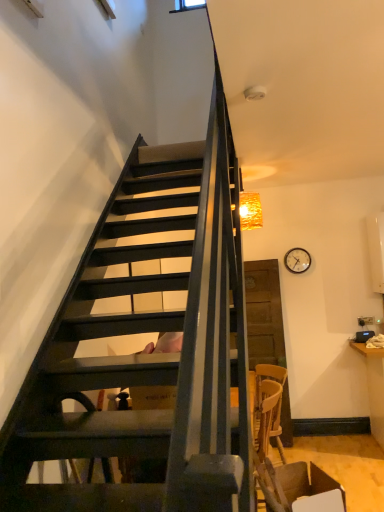
Question: From a real-world perspective, does brown leather armchair at lower right stand above wooden clock at upper right?

Choices:
 (A) no
 (B) yes

Answer: (A)

Question: Can you confirm if brown leather armchair at lower right is smaller than wooden clock at upper right?

Choices:
 (A) no
 (B) yes

Answer: (A)

Question: Is brown leather armchair at lower right shorter than wooden clock at upper right?

Choices:
 (A) yes
 (B) no

Answer: (B)

Question: Can you confirm if brown leather armchair at lower right is taller than wooden clock at upper right?

Choices:
 (A) yes
 (B) no

Answer: (A)

Question: Is brown leather armchair at lower right to the left of wooden clock at upper right from the viewer's perspective?

Choices:
 (A) yes
 (B) no

Answer: (A)

Question: Can you confirm if brown leather armchair at lower right is thinner than wooden clock at upper right?

Choices:
 (A) yes
 (B) no

Answer: (B)

Question: Is crinkled gold lampshade at upper right aimed at wooden clock at upper right?

Choices:
 (A) yes
 (B) no

Answer: (B)

Question: Does crinkled gold lampshade at upper right come behind wooden clock at upper right?

Choices:
 (A) no
 (B) yes

Answer: (A)

Question: Is crinkled gold lampshade at upper right thinner than wooden clock at upper right?

Choices:
 (A) yes
 (B) no

Answer: (B)

Question: Considering the relative sizes of crinkled gold lampshade at upper right and wooden clock at upper right in the image provided, is crinkled gold lampshade at upper right smaller than wooden clock at upper right?

Choices:
 (A) no
 (B) yes

Answer: (A)

Question: Is crinkled gold lampshade at upper right positioned with its back to wooden clock at upper right?

Choices:
 (A) no
 (B) yes

Answer: (A)

Question: Is crinkled gold lampshade at upper right shorter than wooden clock at upper right?

Choices:
 (A) yes
 (B) no

Answer: (B)

Question: Is wooden clock at upper right outside of crinkled gold lampshade at upper right?

Choices:
 (A) no
 (B) yes

Answer: (B)